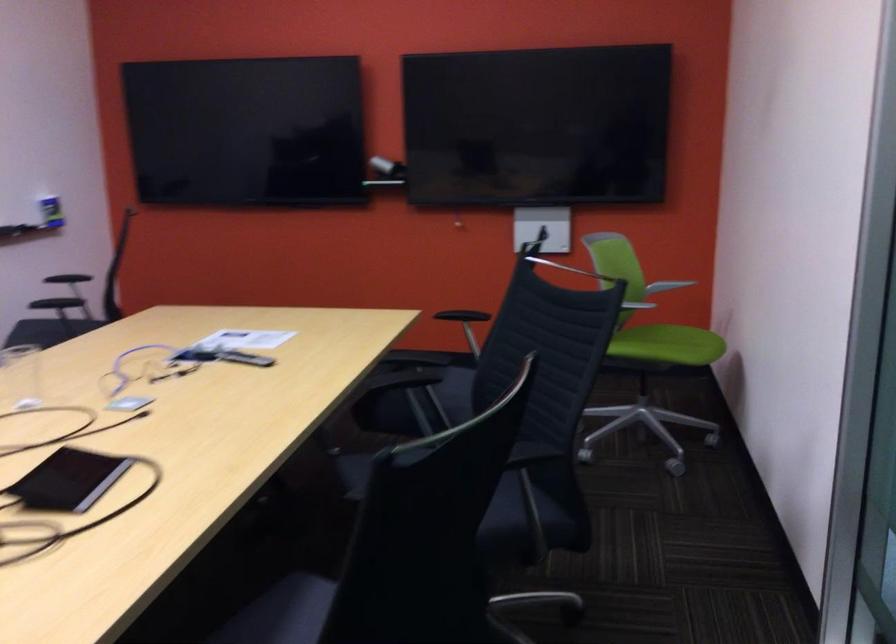
Describe the element at coordinates (67, 480) in the screenshot. I see `the black tablet` at that location.